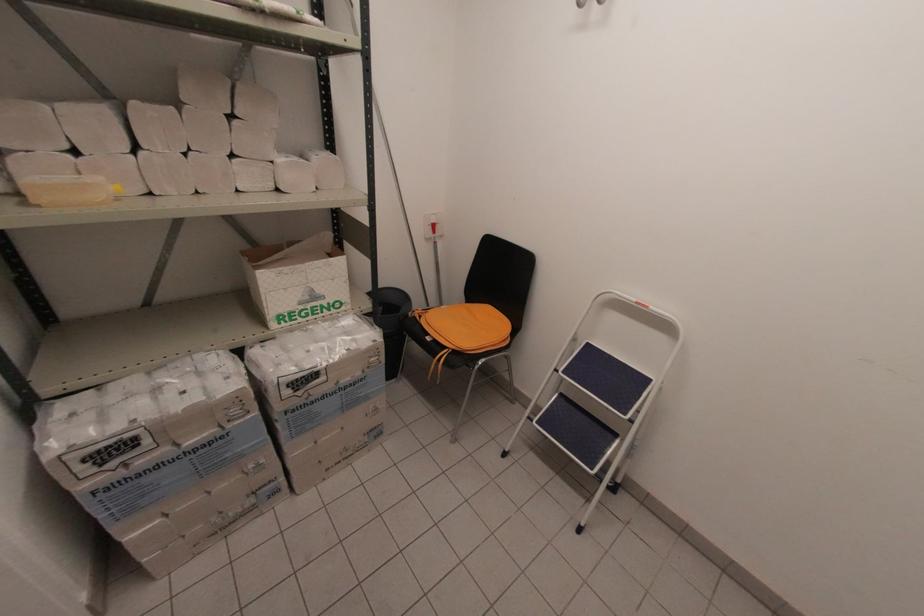
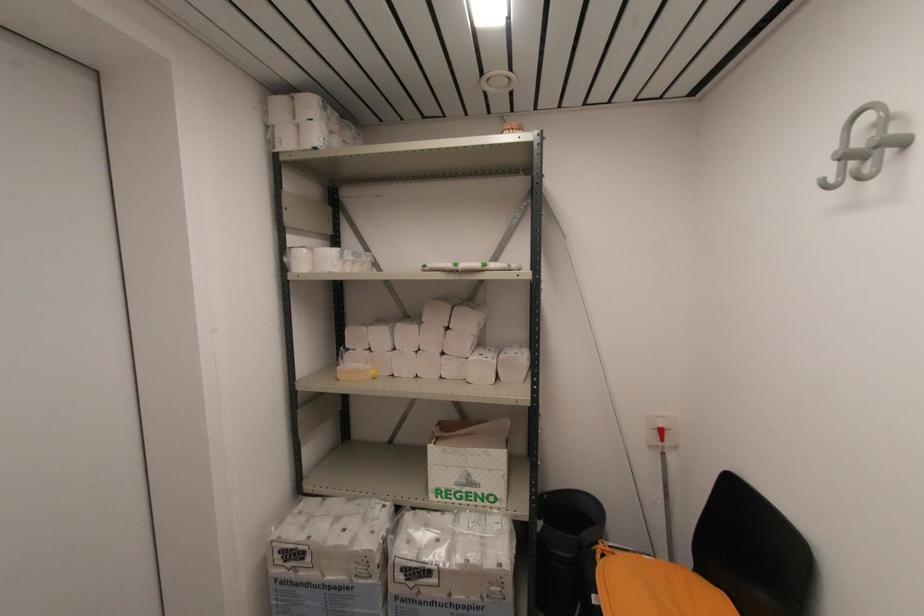
Locate, in the second image, the point that corresponds to point (435, 233) in the first image.

(663, 439)